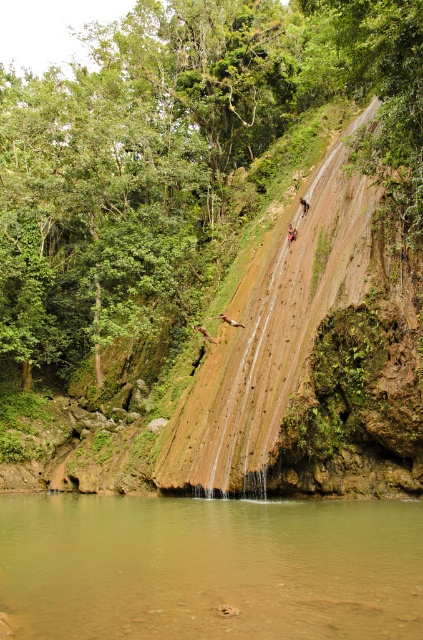
Is brown sedimentary rock at lower center to the left of blurred pink shorts at center from the viewer's perspective?

Correct, you'll find brown sedimentary rock at lower center to the left of blurred pink shorts at center.

Who is more forward, (310,573) or (288,232)?

Point (310,573) is in front.

Is point (140, 621) less distant than point (293, 227)?

Yes, point (140, 621) is closer to viewer.

Identify the location of brown sedimentary rock at lower center. The height and width of the screenshot is (640, 423). (209, 566).

Between brown rough cliff at center and smooth brown rock climber at center, which one appears on the right side from the viewer's perspective?

brown rough cliff at center is more to the right.

The width and height of the screenshot is (423, 640). Find the location of `brown rough cliff at center`. brown rough cliff at center is located at coordinates (310, 360).

Measure the distance between point (349, 259) and camera.

37.72 meters

Where is `brown rough cliff at center`? brown rough cliff at center is located at coordinates (310, 360).

Can you confirm if brown rough cliff at center is wider than blurred pink shorts at center?

Indeed, brown rough cliff at center has a greater width compared to blurred pink shorts at center.

Is point (403, 296) closer to camera compared to point (288, 228)?

Yes, it is in front of point (288, 228).

This screenshot has height=640, width=423. In order to click on brown rough cliff at center in this screenshot , I will do `click(310, 360)`.